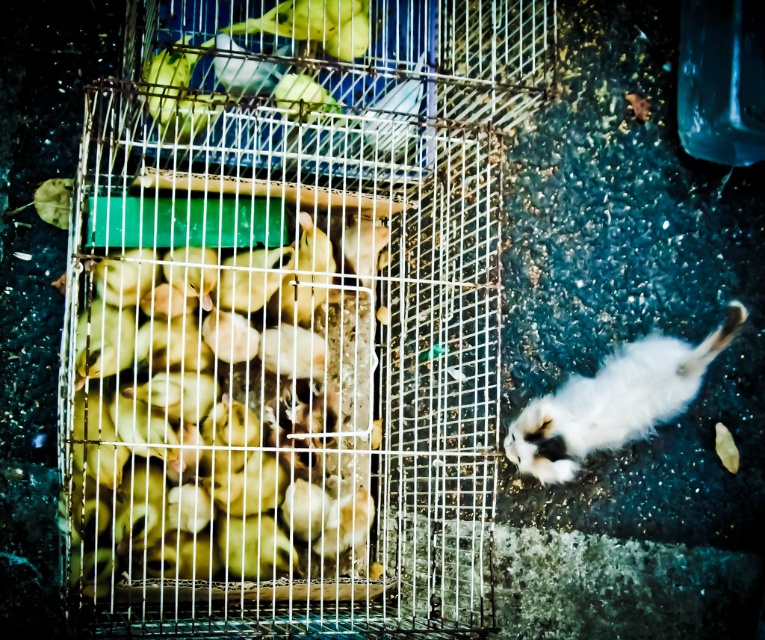
You are a delivery robot that needs to deliver a package to the yellow matte chicks at center. The delivery zone is marked by a point at coordinates (216, 417). Can you confirm if the yellow matte chicks at center are located exactly at this point?

Yes, the point at coordinates (216, 417) marks the location of the yellow matte chicks at center, so they are exactly at this point.

You are taking a photo of the scene and want to focus on both point (433, 198) and point (565, 388). Which point should you adjust your focus to first to ensure both are in focus?

You should focus on point (433, 198) first because it is closer to the camera, and adjusting focus from closer to farther points ensures both will be in focus.